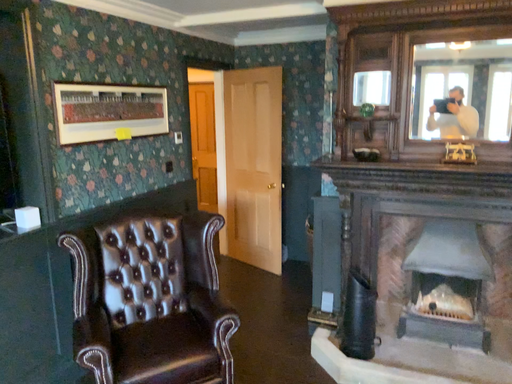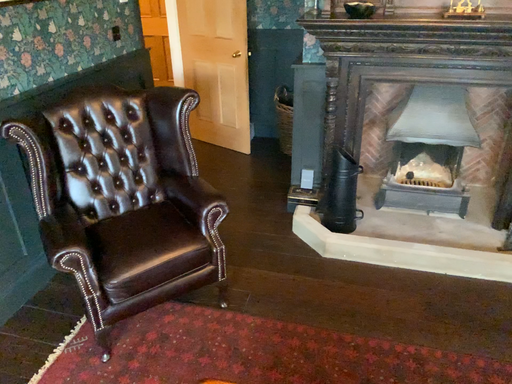
Question: Which way did the camera rotate in the video?

Choices:
 (A) rotated left
 (B) rotated right

Answer: (B)